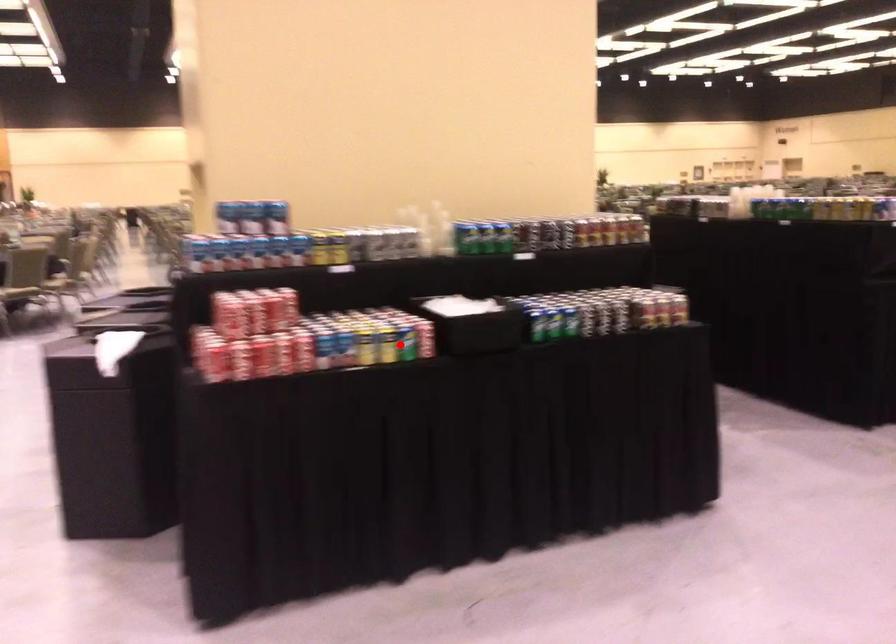
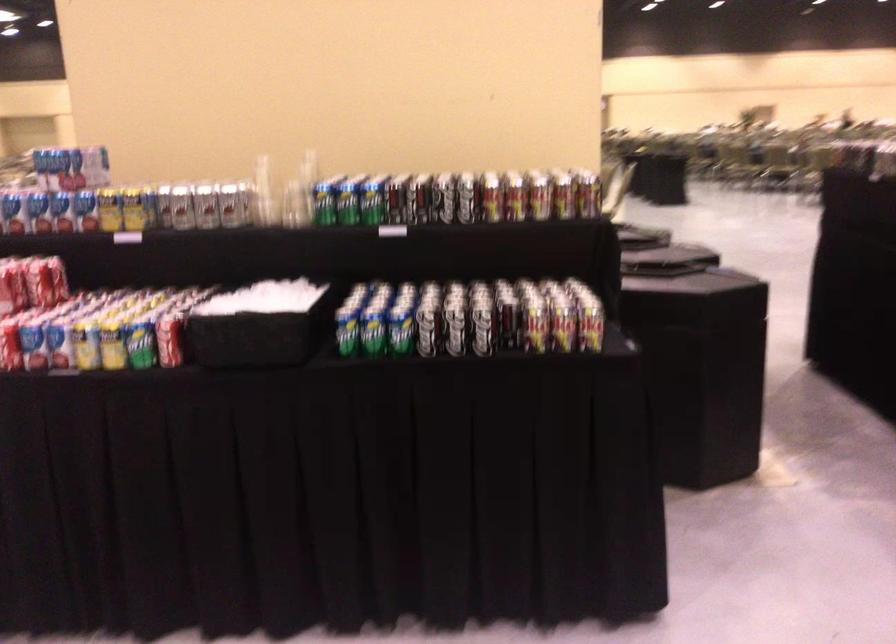
Find the pixel in the second image that matches the highlighted location in the first image.

(140, 345)